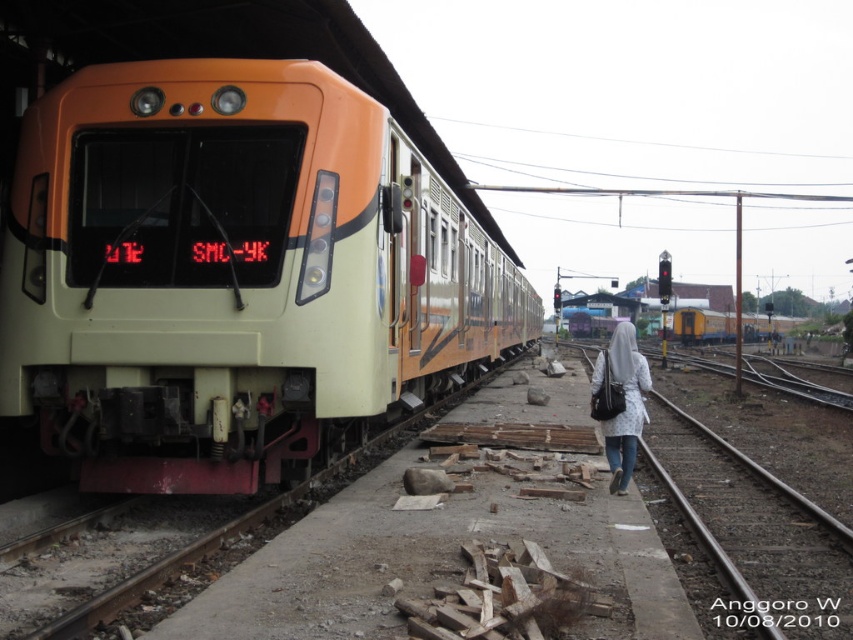
You are standing at the train station and want to board the orange and cream colored train on the left. There is a point marked at coordinates (759, 531) which indicates the location of the brown gravel train track at lower right. Can you walk directly from your current position to the train without stepping on the gravel track?

The point at (759, 531) marks the brown gravel train track at lower right. Since the platform is cluttered with debris like wooden planks and other materials, you would need to navigate around the gravel track to reach the train safely without stepping on it.

You are standing at the point marked as point (671, 448) at a train station. The train is on the left side of the frame. If you want to board the train, which direction should you walk?

Since the train is on the left side of the frame and you are at point (671, 448), you should walk towards the left to board the train.

You are standing on the platform at the train station and want to walk from point [90,154] to point [769,321]. Which direction should you head?

You should head towards the right side of the image since point [769,321] is located to the right of point [90,154].